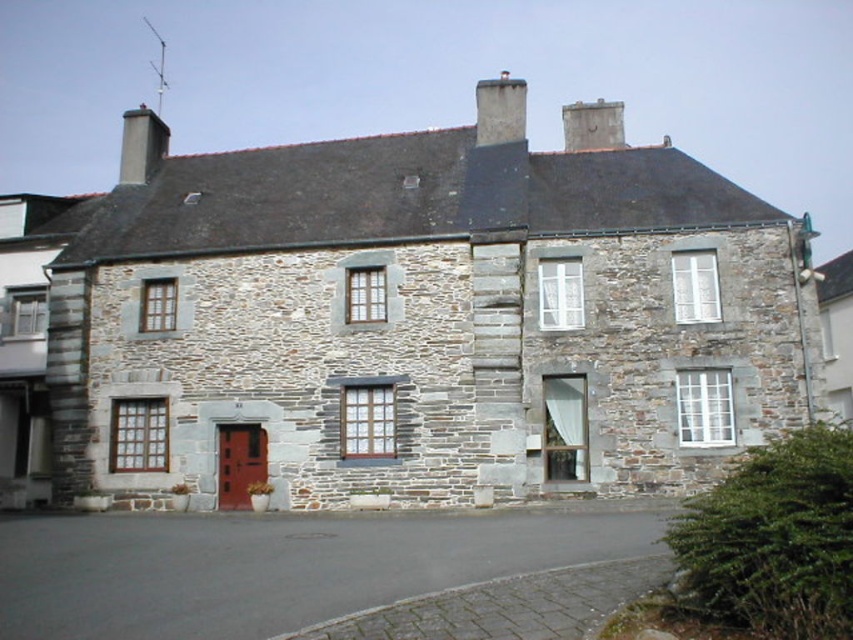
Who is shorter, gray stone chimney at upper center or smooth stone chimney at upper center?

With less height is smooth stone chimney at upper center.

Is gray stone chimney at upper center shorter than smooth stone chimney at upper center?

No, gray stone chimney at upper center is not shorter than smooth stone chimney at upper center.

You are a GUI agent. You are given a task and a screenshot of the screen. Output one action in this format:
    pyautogui.click(x=<x>, y=<y>)
    Task: Click on the gray stone chimney at upper center
    The width and height of the screenshot is (853, 640).
    Given the screenshot: What is the action you would take?
    pyautogui.click(x=500, y=109)

Identify the location of gray stone chimney at upper center. (500, 109).

Is gray stone chimney at upper center wider than smooth gray chimney at upper left?

In fact, gray stone chimney at upper center might be narrower than smooth gray chimney at upper left.

Which of these two, gray stone chimney at upper center or smooth gray chimney at upper left, stands shorter?

smooth gray chimney at upper left is shorter.

The image size is (853, 640). Describe the element at coordinates (500, 109) in the screenshot. I see `gray stone chimney at upper center` at that location.

What are the coordinates of `gray stone chimney at upper center` in the screenshot? It's located at (500, 109).

Can you confirm if smooth wooden door at center is taller than smooth gray chimney at upper left?

In fact, smooth wooden door at center may be shorter than smooth gray chimney at upper left.

Measure the distance between smooth wooden door at center and camera.

They are 40.55 meters apart.

This screenshot has height=640, width=853. Find the location of `smooth wooden door at center`. smooth wooden door at center is located at coordinates (241, 464).